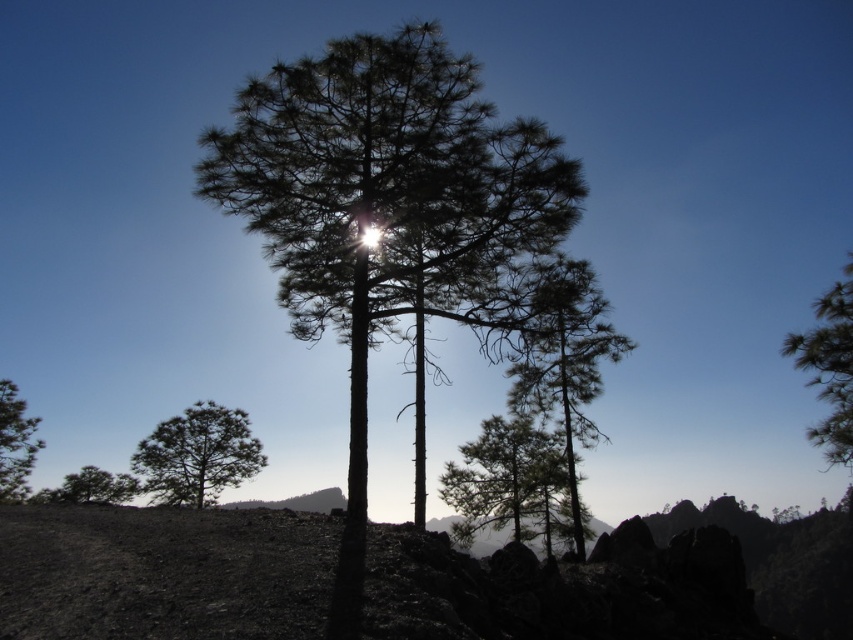
Question: Can you confirm if burnt soil at lower left is wider than bright white light at center?

Choices:
 (A) yes
 (B) no

Answer: (A)

Question: Which point is closer to the camera taking this photo?

Choices:
 (A) (508, 314)
 (B) (523, 540)

Answer: (A)

Question: Is dark green textured tree at center above silhouette pine tree at center?

Choices:
 (A) no
 (B) yes

Answer: (B)

Question: Which point is closer to the camera?

Choices:
 (A) silhouette pine tree at lower left
 (B) silvery textured tree at lower left
 (C) green matte tree at center
 (D) dark green textured tree at center

Answer: (D)

Question: Does green matte tree at upper right have a lesser width compared to silhouette pine tree at lower left?

Choices:
 (A) yes
 (B) no

Answer: (B)

Question: Which object is farther from the camera taking this photo?

Choices:
 (A) silvery textured tree at lower left
 (B) bright white light at center

Answer: (A)